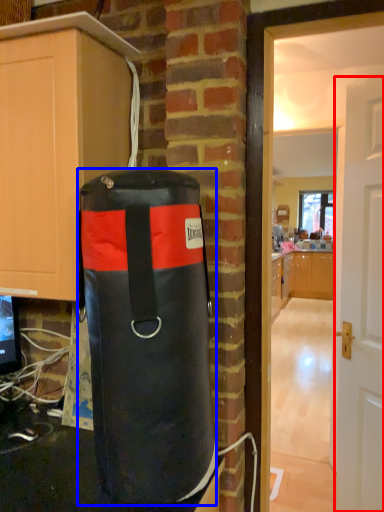
Question: Which object is further to the camera taking this photo, door (highlighted by a red box) or punching bag (highlighted by a blue box)?

Choices:
 (A) door
 (B) punching bag

Answer: (A)